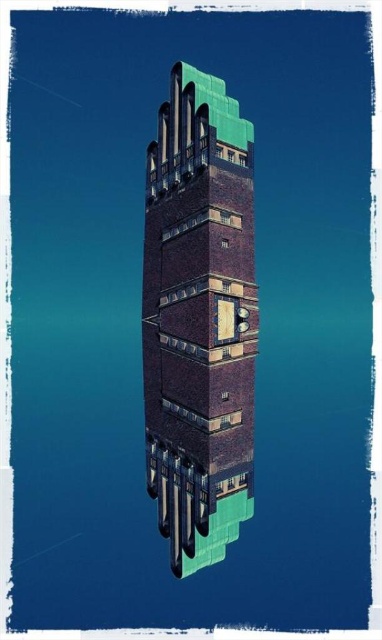
Question: Can you confirm if brown brick tower at center is wider than green glossy pipes at lower center?

Choices:
 (A) no
 (B) yes

Answer: (B)

Question: Is brown brick tower at center closer to the viewer compared to green glossy pipes at lower center?

Choices:
 (A) no
 (B) yes

Answer: (A)

Question: Which point is closer to the camera taking this photo?

Choices:
 (A) (x=199, y=72)
 (B) (x=228, y=492)

Answer: (B)

Question: Which point is farther to the camera?

Choices:
 (A) (236, 500)
 (B) (200, 76)

Answer: (B)

Question: Does brown brick tower at center appear on the left side of green glossy pipes at lower center?

Choices:
 (A) no
 (B) yes

Answer: (A)

Question: Among these points, which one is farthest from the camera?

Choices:
 (A) (194, 253)
 (B) (223, 528)

Answer: (A)